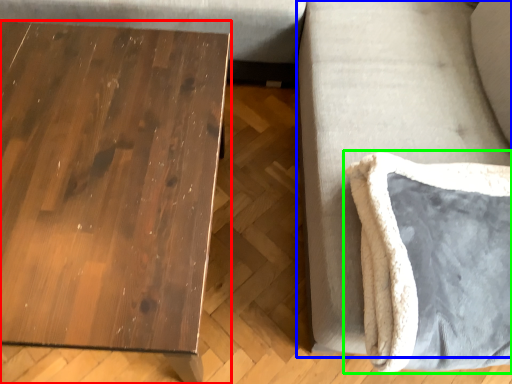
Question: Considering the real-world distances, which object is farthest from table (highlighted by a red box)? couch (highlighted by a blue box) or swivel chair (highlighted by a green box)?

Choices:
 (A) couch
 (B) swivel chair

Answer: (B)